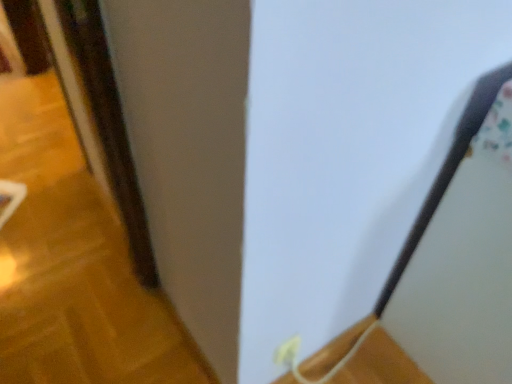
This screenshot has width=512, height=384. What do you see at coordinates (379, 364) in the screenshot? I see `wooden at lower right` at bounding box center [379, 364].

Where is `wooden at lower right`? wooden at lower right is located at coordinates (379, 364).

From the image's perspective, which is above, wooden at lower right or white plastic electric outlet at lower center?

white plastic electric outlet at lower center, from the image's perspective.

Who is shorter, wooden at lower right or white plastic electric outlet at lower center?

With less height is wooden at lower right.

Is wooden at lower right positioned with its back to white plastic electric outlet at lower center?

No, wooden at lower right's orientation is not away from white plastic electric outlet at lower center.

Are white plastic electric outlet at lower center and brown wooden door at left making contact?

No, white plastic electric outlet at lower center is not touching brown wooden door at left.

From the picture: Measure the distance from white plastic electric outlet at lower center to brown wooden door at left.

white plastic electric outlet at lower center is 3.43 feet away from brown wooden door at left.

From their relative heights in the image, would you say white plastic electric outlet at lower center is taller or shorter than brown wooden door at left?

white plastic electric outlet at lower center is taller than brown wooden door at left.

Considering the positions of points (287, 345) and (40, 50), is point (287, 345) farther from camera compared to point (40, 50)?

No, it is in front of (40, 50).

Image resolution: width=512 pixels, height=384 pixels. Identify the location of wood to the right of brown wooden door at left. (379, 364).

Which of these two, brown wooden door at left or wooden at lower right, stands taller?

Standing taller between the two is brown wooden door at left.

Between brown wooden door at left and wooden at lower right, which one is positioned behind?

Positioned behind is brown wooden door at left.

Would you say brown wooden door at left is a long distance from wooden at lower right?

brown wooden door at left is near wooden at lower right, not far away.

Is the depth of brown wooden door at left greater than that of white plastic electric outlet at lower center?

Yes, it is behind white plastic electric outlet at lower center.

Based on the photo, is brown wooden door at left located outside white plastic electric outlet at lower center?

Yes, brown wooden door at left is outside of white plastic electric outlet at lower center.

Looking at this image, from the image's perspective, is brown wooden door at left located above or below white plastic electric outlet at lower center?

Based on their image positions, brown wooden door at left is located above white plastic electric outlet at lower center.

How many degrees apart are the facing directions of brown wooden door at left and white plastic electric outlet at lower center?

brown wooden door at left and white plastic electric outlet at lower center are facing 0.706 degrees away from each other.

Is wooden at lower right oriented towards brown wooden door at left?

No, wooden at lower right is not facing towards brown wooden door at left.

Between wooden at lower right and brown wooden door at left, which one has smaller size?

wooden at lower right.

Would you say wooden at lower right is a long distance from brown wooden door at left?

wooden at lower right is actually quite close to brown wooden door at left.

Which point is more distant from viewer, [337,379] or [95,336]?

Point [95,336]

Is white plastic electric outlet at lower center completely or partially outside of wooden at lower right?

Absolutely, white plastic electric outlet at lower center is external to wooden at lower right.

Is white plastic electric outlet at lower center turned away from wooden at lower right?

No, white plastic electric outlet at lower center is not facing away from wooden at lower right.

Which is more distant, (289, 354) or (380, 381)?

The point (380, 381) is farther.

How different are the orientations of white plastic electric outlet at lower center and wooden at lower right in degrees?

There is a 0.637-degree angle between the facing directions of white plastic electric outlet at lower center and wooden at lower right.

Identify the location of electric outlet above the wooden at lower right (from the image's perspective). The width and height of the screenshot is (512, 384). (288, 352).

Locate an element on the screen. electric outlet on the right side of brown wooden door at left is located at coordinates (288, 352).

In the scene shown: Looking at the image, which one is located further to wooden at lower right, white plastic electric outlet at lower center or brown wooden door at left?

The object further to wooden at lower right is brown wooden door at left.

Consider the image. Based on their spatial positions, is white plastic electric outlet at lower center or wooden at lower right further from brown wooden door at left?

white plastic electric outlet at lower center lies further to brown wooden door at left than the other object.

Looking at the image, which one is located closer to white plastic electric outlet at lower center, brown wooden door at left or wooden at lower right?

The object closer to white plastic electric outlet at lower center is wooden at lower right.

Estimate the real-world distances between objects in this image. Which object is closer to white plastic electric outlet at lower center, wooden at lower right or brown wooden door at left?

wooden at lower right lies closer to white plastic electric outlet at lower center than the other object.

From the image, which object appears to be farther from brown wooden door at left, wooden at lower right or white plastic electric outlet at lower center?

Based on the image, white plastic electric outlet at lower center appears to be further to brown wooden door at left.

Estimate the real-world distances between objects in this image. Which object is further from wooden at lower right, brown wooden door at left or white plastic electric outlet at lower center?

brown wooden door at left.

You are a GUI agent. You are given a task and a screenshot of the screen. Output one action in this format:
    pyautogui.click(x=<x>, y=<y>)
    Task: Click on the electric outlet situated between brown wooden door at left and wooden at lower right from left to right
    
    Given the screenshot: What is the action you would take?
    pyautogui.click(x=288, y=352)